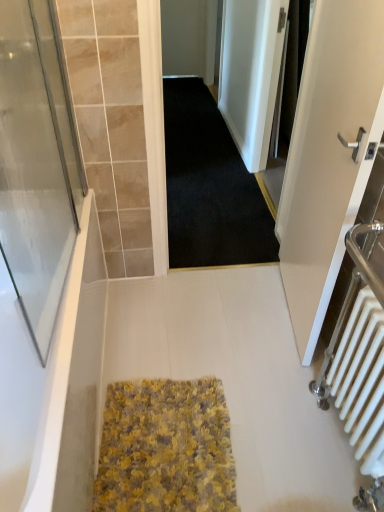
Locate an element on the screen. The width and height of the screenshot is (384, 512). free space underneath yellow textured rug at center (from a real-world perspective) is located at coordinates (173, 442).